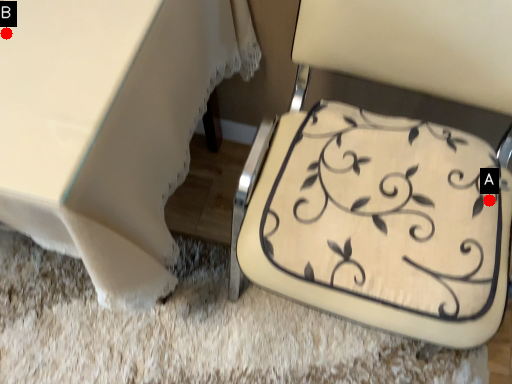
Question: Two points are circled on the image, labeled by A and B beside each circle. Which of the following is the farthest from the observer?

Choices:
 (A) A is further
 (B) B is further

Answer: (A)